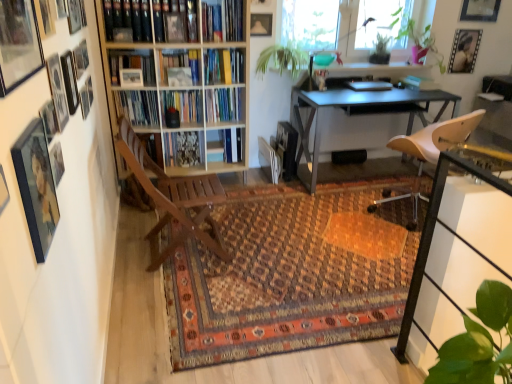
Question: From a real-world perspective, is matte black picture frame at upper left, the 7th picture frame when ordered from left to right, physically located above or below wooden picture frame at upper left, arranged as the 8th picture frame when viewed from the left?

Choices:
 (A) below
 (B) above

Answer: (A)

Question: Is matte black picture frame at upper left, which appears as the 6th picture frame when viewed from the front, in front of or behind wooden picture frame at upper left, arranged as the 5th picture frame when viewed from the front, in the image?

Choices:
 (A) behind
 (B) front

Answer: (A)

Question: Which of these objects is positioned farthest from the metallic silver table at center?

Choices:
 (A) green leafy plant at upper right, marked as the 2th plant in a left-to-right arrangement
 (B) wooden bookcase at left
 (C) patterned carpet at center
 (D) wooden picture frame at upper left, positioned as the eighth picture frame in back-to-front order
 (E) metallic silver picture frame at upper left, the ninth picture frame from the front

Answer: (A)

Question: Estimate the real-world distances between objects in this image. Which object is farther from the matte black picture frame at left, which is counted as the second picture frame, starting from the front?

Choices:
 (A) patterned carpet at center
 (B) matte glass picture frame at upper left, placed as the thirteenth picture frame when sorted from back to front
 (C) matte black picture frame at upper left, which ranks as the tenth picture frame in back-to-front order
 (D) matte black picture frame at upper center, the fourth picture frame positioned from the right
 (E) wooden bookcase at left

Answer: (D)